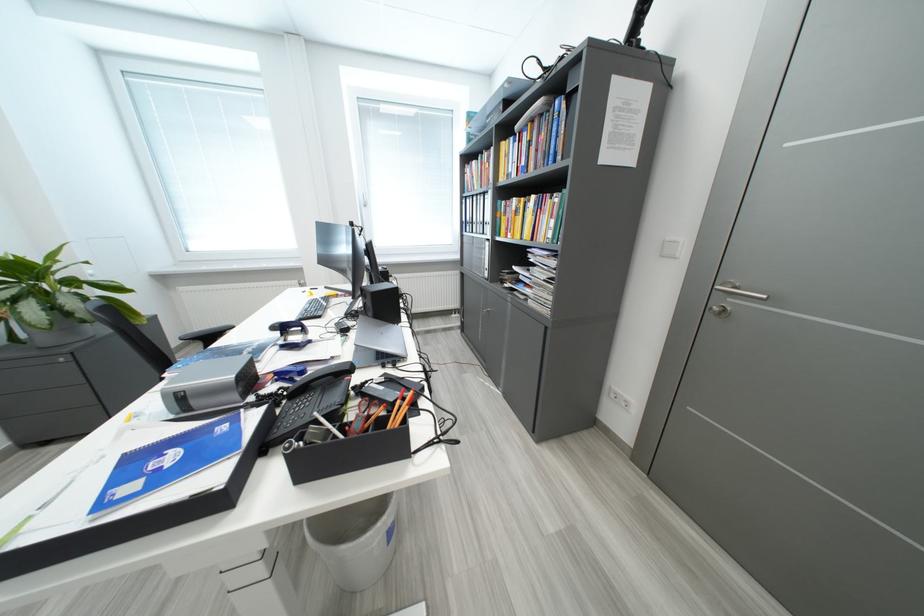
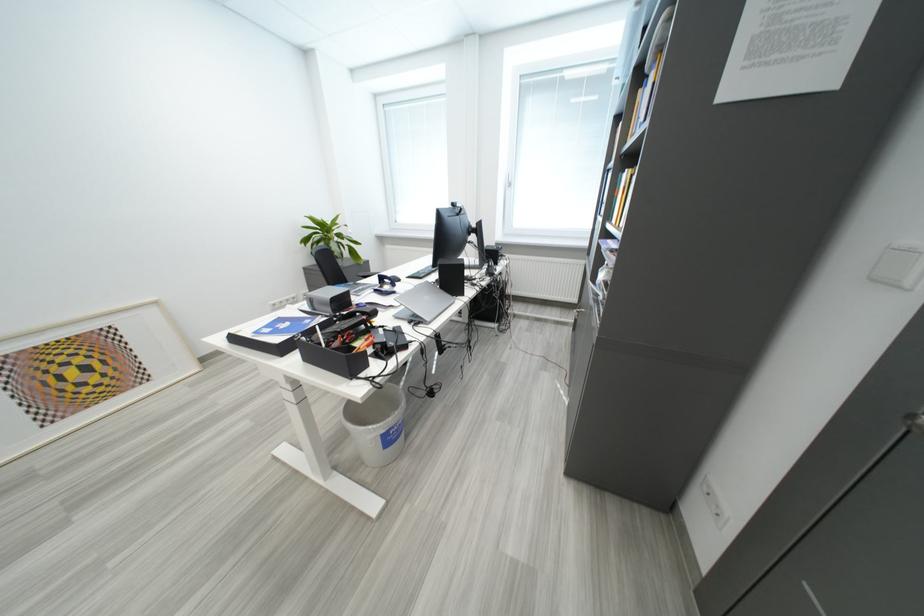
Where in the second image is the point corresponding to (232,430) from the first image?

(317, 323)